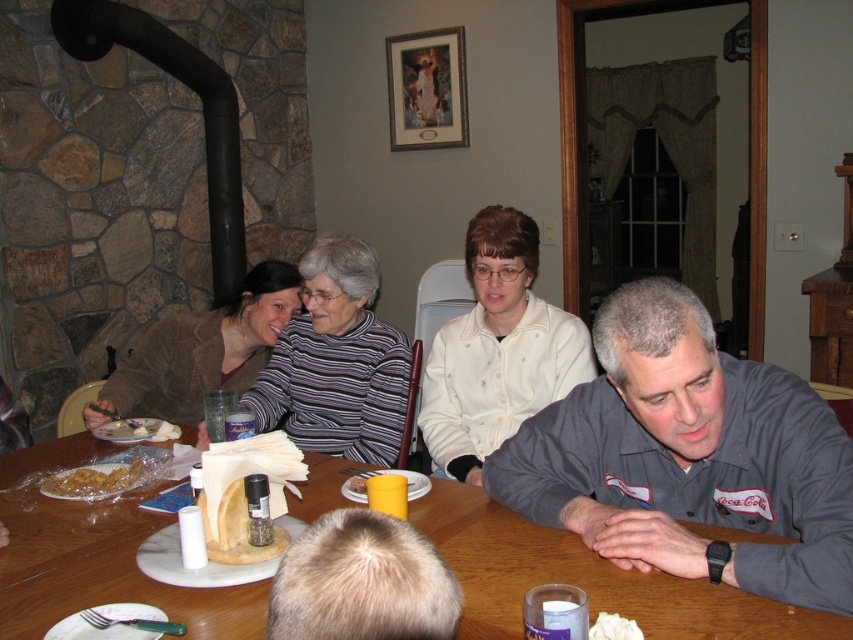
Question: Where is gray fabric shirt at lower right located in relation to white matte jacket at center in the image?

Choices:
 (A) left
 (B) right

Answer: (B)

Question: Is striped sweater at center below white fluffy bread at lower center?

Choices:
 (A) yes
 (B) no

Answer: (B)

Question: Among these points, which one is farthest from the camera?

Choices:
 (A) (671, 582)
 (B) (207, 378)
 (C) (347, 364)

Answer: (B)

Question: Which of the following is the closest to the observer?

Choices:
 (A) yellow matte/yellowish-orange at center
 (B) gray fabric shirt at lower right
 (C) white fluffy bread at lower center

Answer: (C)

Question: Which object appears farthest from the camera in this image?

Choices:
 (A) brown fuzzy sweater at upper left
 (B) golden crispy chicken at lower left
 (C) wooden table at center
 (D) yellow matte/yellowish-orange at center

Answer: (A)

Question: Does gray fabric shirt at lower right appear under brown fuzzy sweater at upper left?

Choices:
 (A) no
 (B) yes

Answer: (B)